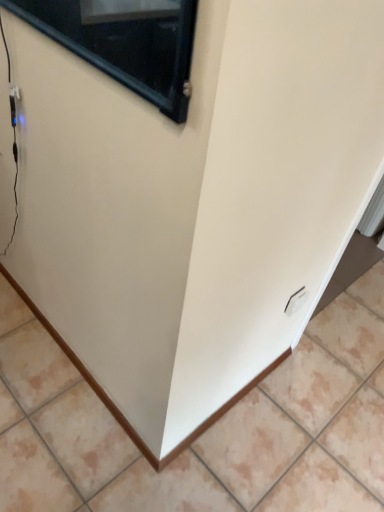
This screenshot has height=512, width=384. What do you see at coordinates (208, 429) in the screenshot? I see `white glossy tile at center` at bounding box center [208, 429].

The height and width of the screenshot is (512, 384). Identify the location of white glossy tile at center. (208, 429).

At what (x,y) coordinates should I click in order to perform the action: click on white glossy tile at center. Please return your answer as a coordinate pair (x, y). The width and height of the screenshot is (384, 512). Looking at the image, I should click on (208, 429).